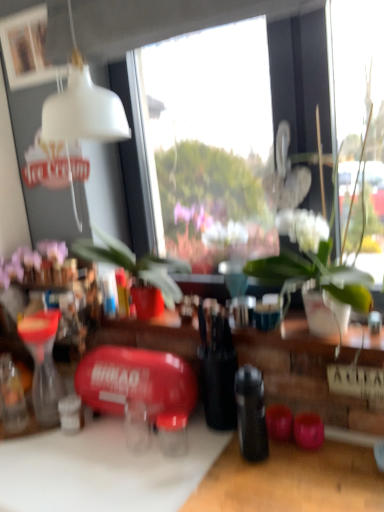
Question: Does white matte picture frame at upper left lie in front of black matte bottle at center?

Choices:
 (A) no
 (B) yes

Answer: (A)

Question: Is white matte picture frame at upper left next to black matte bottle at center?

Choices:
 (A) no
 (B) yes

Answer: (A)

Question: From the image's perspective, is white matte picture frame at upper left under black matte bottle at center?

Choices:
 (A) yes
 (B) no

Answer: (B)

Question: Is white matte picture frame at upper left far from black matte bottle at center?

Choices:
 (A) yes
 (B) no

Answer: (A)

Question: From the image's perspective, is white matte picture frame at upper left over black matte bottle at center?

Choices:
 (A) yes
 (B) no

Answer: (A)

Question: Considering the relative positions of black matte bottle at center and white matte picture frame at upper left in the image provided, is black matte bottle at center to the left or to the right of white matte picture frame at upper left?

Choices:
 (A) left
 (B) right

Answer: (B)

Question: From their relative heights in the image, would you say black matte bottle at center is taller or shorter than white matte picture frame at upper left?

Choices:
 (A) tall
 (B) short

Answer: (A)

Question: Considering the positions of black matte bottle at center and white matte picture frame at upper left in the image, is black matte bottle at center bigger or smaller than white matte picture frame at upper left?

Choices:
 (A) big
 (B) small

Answer: (B)

Question: From the image's perspective, relative to white matte picture frame at upper left, is black matte bottle at center above or below?

Choices:
 (A) above
 (B) below

Answer: (B)

Question: Is white matte cutting board at lower left in front of or behind white glossy vase at center in the image?

Choices:
 (A) front
 (B) behind

Answer: (A)

Question: From a real-world perspective, is white matte cutting board at lower left physically located above or below white glossy vase at center?

Choices:
 (A) above
 (B) below

Answer: (B)

Question: Is point (46, 451) closer or farther from the camera than point (299, 279)?

Choices:
 (A) closer
 (B) farther

Answer: (B)

Question: Based on their positions, is white matte cutting board at lower left located to the left or right of white glossy vase at center?

Choices:
 (A) right
 (B) left

Answer: (B)

Question: From a real-world perspective, is purple matte flowers at upper left physically located above or below black matte bottle at center?

Choices:
 (A) below
 (B) above

Answer: (B)

Question: Relative to black matte bottle at center, is purple matte flowers at upper left in front or behind?

Choices:
 (A) front
 (B) behind

Answer: (B)